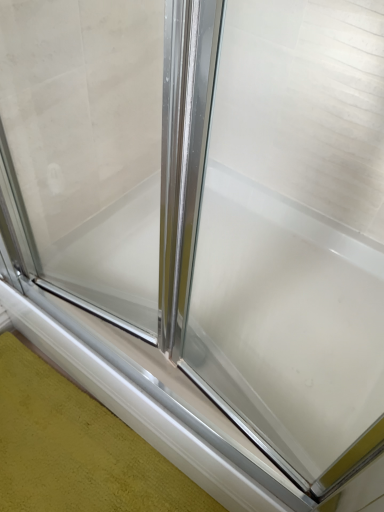
Question: Is white glossy window sill at lower center taller or shorter than clear glass shower door at center?

Choices:
 (A) tall
 (B) short

Answer: (B)

Question: Considering the positions of point (276, 480) and point (115, 210), is point (276, 480) closer or farther from the camera than point (115, 210)?

Choices:
 (A) closer
 (B) farther

Answer: (A)

Question: Is white glossy window sill at lower center wider or thinner than clear glass shower door at center?

Choices:
 (A) thin
 (B) wide

Answer: (B)

Question: In the image, is clear glass shower door at center on the left side or the right side of white glossy window sill at lower center?

Choices:
 (A) left
 (B) right

Answer: (B)

Question: Considering the positions of point (142, 7) and point (145, 377), is point (142, 7) closer or farther from the camera than point (145, 377)?

Choices:
 (A) closer
 (B) farther

Answer: (B)

Question: Is clear glass shower door at center spatially inside white glossy window sill at lower center, or outside of it?

Choices:
 (A) outside
 (B) inside

Answer: (A)

Question: Is clear glass shower door at center in front of or behind white glossy window sill at lower center in the image?

Choices:
 (A) front
 (B) behind

Answer: (A)